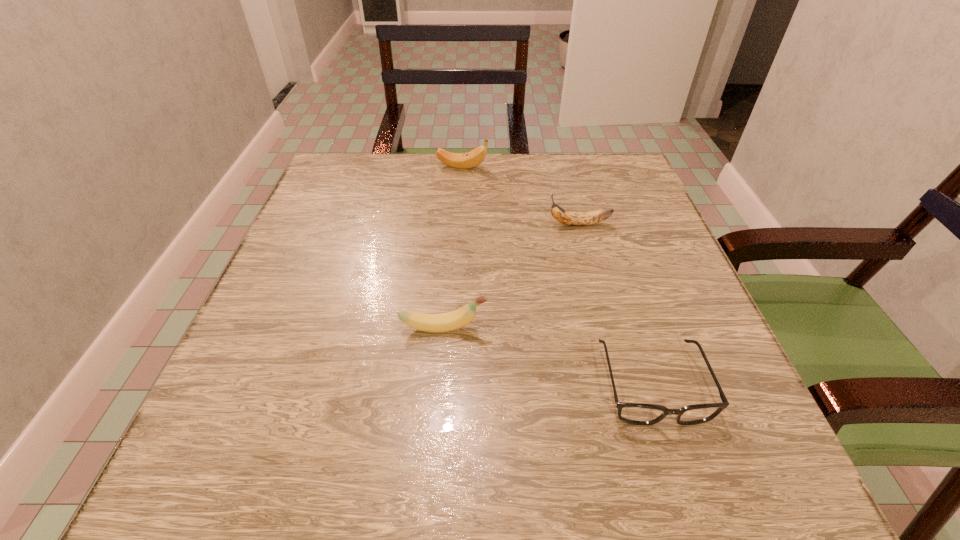
Locate an element on the screen. This screenshot has width=960, height=540. vacant space at the far right corner is located at coordinates (634, 175).

Locate an element on the screen. The image size is (960, 540). vacant space that is in between the farthest banana and the shortest object is located at coordinates (557, 275).

Locate an element on the screen. unoccupied area between the second farthest banana and the farthest object is located at coordinates (520, 195).

Locate an element on the screen. The height and width of the screenshot is (540, 960). empty space between the second nearest object and the farthest object is located at coordinates (453, 247).

The width and height of the screenshot is (960, 540). Identify the location of free space between the shortest object and the nearest banana. (548, 356).

Locate an element on the screen. free space between the nearest object and the second nearest object is located at coordinates (548, 356).

In order to click on vacant area that lies between the farthest object and the rightmost banana in this screenshot , I will do `click(520, 195)`.

You are a GUI agent. You are given a task and a screenshot of the screen. Output one action in this format:
    pyautogui.click(x=<x>, y=<y>)
    Task: Click on the free area in between the nearest object and the nearest banana
    
    Given the screenshot: What is the action you would take?
    548,356

Locate an element on the screen. vacant area that lies between the farthest object and the nearest banana is located at coordinates (453, 247).

The width and height of the screenshot is (960, 540). What are the coordinates of `vacant space that's between the farthest object and the second farthest banana` in the screenshot? It's located at (520, 195).